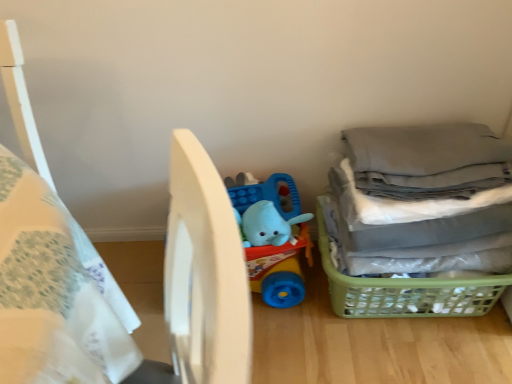
This screenshot has width=512, height=384. I want to click on gray fabric laundry at right, so click(423, 200).

In order to face white matte bed at center, should I rotate leftwards or rightwards?

Turn left by 21.442 degrees to look at white matte bed at center.

Describe the element at coordinates (273, 237) in the screenshot. I see `blue rubber elephant at center` at that location.

Where is `gray fabric laundry at right`? The width and height of the screenshot is (512, 384). gray fabric laundry at right is located at coordinates (423, 200).

How distant is gray fabric laundry at right from white matte bed at center?

28.11 inches.

Which is more to the right, gray fabric laundry at right or white matte bed at center?

gray fabric laundry at right.

Does point (477, 164) appear closer or farther from the camera than point (210, 193)?

Point (477, 164) appears to be farther away from the viewer than point (210, 193).

Could you tell me if gray fabric laundry at right is facing white matte bed at center?

No, gray fabric laundry at right is not turned towards white matte bed at center.

From a real-world perspective, is green plastic basket at lower right over white matte bed at center?

No, from a real-world perspective, green plastic basket at lower right is not on top of white matte bed at center.

Considering the sizes of objects green plastic basket at lower right and white matte bed at center in the image provided, who is taller, green plastic basket at lower right or white matte bed at center?

white matte bed at center is taller.

Is green plastic basket at lower right not within white matte bed at center?

Yes, green plastic basket at lower right is outside of white matte bed at center.

Looking at this image, which of these two, green plastic basket at lower right or gray fabric laundry at right, is smaller?

With smaller size is green plastic basket at lower right.

Can you confirm if green plastic basket at lower right is shorter than gray fabric laundry at right?

Correct, green plastic basket at lower right is not as tall as gray fabric laundry at right.

Consider the image. Is green plastic basket at lower right further to camera compared to gray fabric laundry at right?

Yes, it is.

The height and width of the screenshot is (384, 512). I want to click on toy on the left of gray fabric laundry at right, so click(x=273, y=237).

From the image's perspective, who appears lower, gray fabric laundry at right or blue rubber elephant at center?

blue rubber elephant at center appears lower in the image.

From a real-world perspective, is gray fabric laundry at right under blue rubber elephant at center?

No, from a real-world perspective, gray fabric laundry at right is not below blue rubber elephant at center.

Considering the relative positions of gray fabric laundry at right and blue rubber elephant at center in the image provided, is gray fabric laundry at right to the right of blue rubber elephant at center from the viewer's perspective?

Correct, you'll find gray fabric laundry at right to the right of blue rubber elephant at center.

Based on the photo, is gray fabric laundry at right in contact with green plastic basket at lower right?

No.

How much distance is there between gray fabric laundry at right and green plastic basket at lower right?

gray fabric laundry at right is 6.46 inches away from green plastic basket at lower right.

Between gray fabric laundry at right and green plastic basket at lower right, which one has more height?

gray fabric laundry at right.

Locate an element on the screen. The image size is (512, 384). basket lying on the right of gray fabric laundry at right is located at coordinates (406, 292).

Considering the positions of point (189, 329) and point (398, 196), is point (189, 329) closer or farther from the camera than point (398, 196)?

Point (189, 329) is positioned closer to the camera compared to point (398, 196).

Would you consider white matte bed at center to be distant from gray fabric laundry at right?

No.

Which object is positioned more to the left, white matte bed at center or gray fabric laundry at right?

Positioned to the left is white matte bed at center.

From a real-world perspective, is white matte bed at center physically below gray fabric laundry at right?

Actually, white matte bed at center is physically above gray fabric laundry at right in the real world.

Which of these two, white matte bed at center or green plastic basket at lower right, is bigger?

white matte bed at center.

Is green plastic basket at lower right a part of white matte bed at center?

No, green plastic basket at lower right is located outside of white matte bed at center.

Looking at this image, which of these two, white matte bed at center or green plastic basket at lower right, is wider?

With larger width is white matte bed at center.

This screenshot has width=512, height=384. I want to click on bed in front of the gray fabric laundry at right, so click(x=120, y=289).

Locate an element on the screen. basket above the white matte bed at center (from the image's perspective) is located at coordinates (406, 292).

Considering their positions, is blue rubber elephant at center positioned further to green plastic basket at lower right than white matte bed at center?

white matte bed at center is further to green plastic basket at lower right.

Looking at the image, which one is located closer to white matte bed at center, blue rubber elephant at center or gray fabric laundry at right?

blue rubber elephant at center is closer to white matte bed at center.

Based on their spatial positions, is white matte bed at center or blue rubber elephant at center further from gray fabric laundry at right?

white matte bed at center is further to gray fabric laundry at right.

Estimate the real-world distances between objects in this image. Which object is further from green plastic basket at lower right, white matte bed at center or gray fabric laundry at right?

Among the two, white matte bed at center is located further to green plastic basket at lower right.

Estimate the real-world distances between objects in this image. Which object is closer to blue rubber elephant at center, green plastic basket at lower right or gray fabric laundry at right?

green plastic basket at lower right is positioned closer to the anchor blue rubber elephant at center.

Based on their spatial positions, is white matte bed at center or blue rubber elephant at center further from green plastic basket at lower right?

white matte bed at center is positioned further to the anchor green plastic basket at lower right.

Which object lies nearer to the anchor point white matte bed at center, green plastic basket at lower right or gray fabric laundry at right?

Among the two, gray fabric laundry at right is located nearer to white matte bed at center.

Estimate the real-world distances between objects in this image. Which object is closer to green plastic basket at lower right, blue rubber elephant at center or gray fabric laundry at right?

The object closer to green plastic basket at lower right is gray fabric laundry at right.

I want to click on laundry located between white matte bed at center and blue rubber elephant at center in the depth direction, so click(x=423, y=200).

Locate an element on the screen. The height and width of the screenshot is (384, 512). basket positioned between white matte bed at center and blue rubber elephant at center from near to far is located at coordinates (406, 292).

Find the location of a particular element. This screenshot has height=384, width=512. laundry between blue rubber elephant at center and green plastic basket at lower right from left to right is located at coordinates (423, 200).

Image resolution: width=512 pixels, height=384 pixels. What are the coordinates of `laundry between white matte bed at center and green plastic basket at lower right along the z-axis` in the screenshot? It's located at (423, 200).